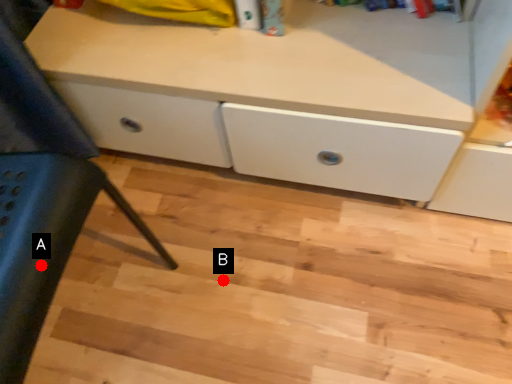
Question: Two points are circled on the image, labeled by A and B beside each circle. Among these points, which one is farthest from the camera?

Choices:
 (A) A is further
 (B) B is further

Answer: (B)